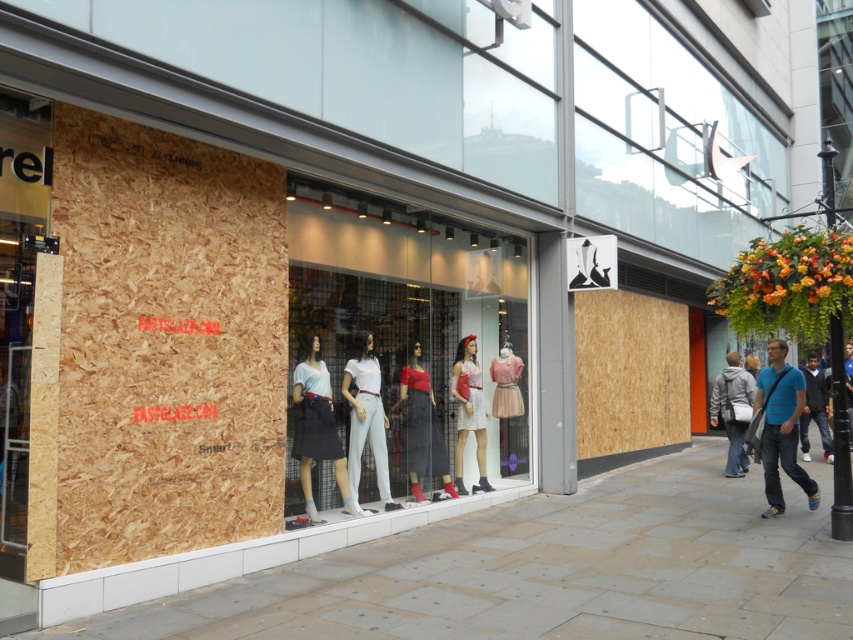
Who is higher up, matte white t-shirt at center or matte red blouse at center?

Positioned higher is matte white t-shirt at center.

Between point (318, 372) and point (404, 448), which one is positioned behind?

The point (404, 448) is behind.

Where is `matte white t-shirt at center`? matte white t-shirt at center is located at coordinates (317, 429).

Between point (788, 426) and point (380, 413), which one is positioned behind?

Positioned behind is point (380, 413).

Locate an element on the screen. The image size is (853, 640). blue striped shirt at lower right is located at coordinates (781, 426).

The image size is (853, 640). In order to click on blue striped shirt at lower right in this screenshot , I will do `click(781, 426)`.

Does smooth concrete pavement at center have a smaller size compared to blue striped shirt at lower right?

→ Incorrect, smooth concrete pavement at center is not smaller in size than blue striped shirt at lower right.

Identify the location of smooth concrete pavement at center. (550, 570).